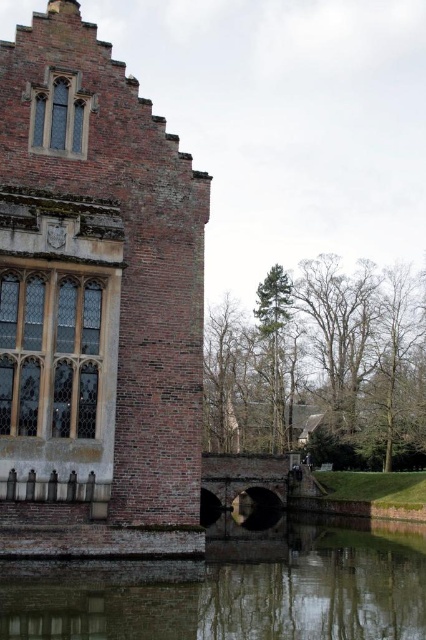
Which is below, brick wall at left or smooth reflective water at lower center?

smooth reflective water at lower center is lower down.

Which is in front, point (112, 317) or point (324, 576)?

Positioned in front is point (112, 317).

Locate an element on the screen. The width and height of the screenshot is (426, 640). brick wall at left is located at coordinates (95, 305).